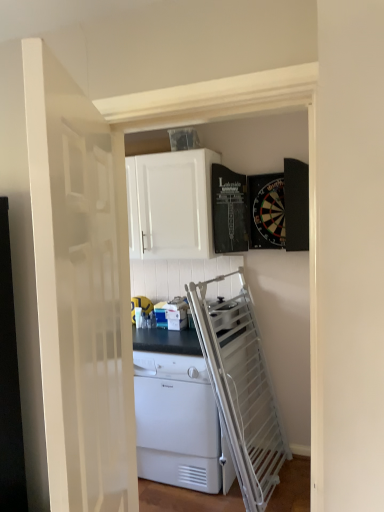
Question: Is white matte cabinet at upper center inside or outside of yellow rubber ball at center?

Choices:
 (A) inside
 (B) outside

Answer: (B)

Question: Considering the positions of white matte cabinet at upper center and yellow rubber ball at center in the image, is white matte cabinet at upper center wider or thinner than yellow rubber ball at center?

Choices:
 (A) wide
 (B) thin

Answer: (A)

Question: Which object is positioned farthest from the yellow rubber ball at center?

Choices:
 (A) white matte cabinet at upper center
 (B) white glossy door at center
 (C) white plastic dishwasher at center

Answer: (B)

Question: Which object is positioned farthest from the yellow rubber ball at center?

Choices:
 (A) white glossy door at center
 (B) white plastic dishwasher at center
 (C) white matte cabinet at upper center

Answer: (A)